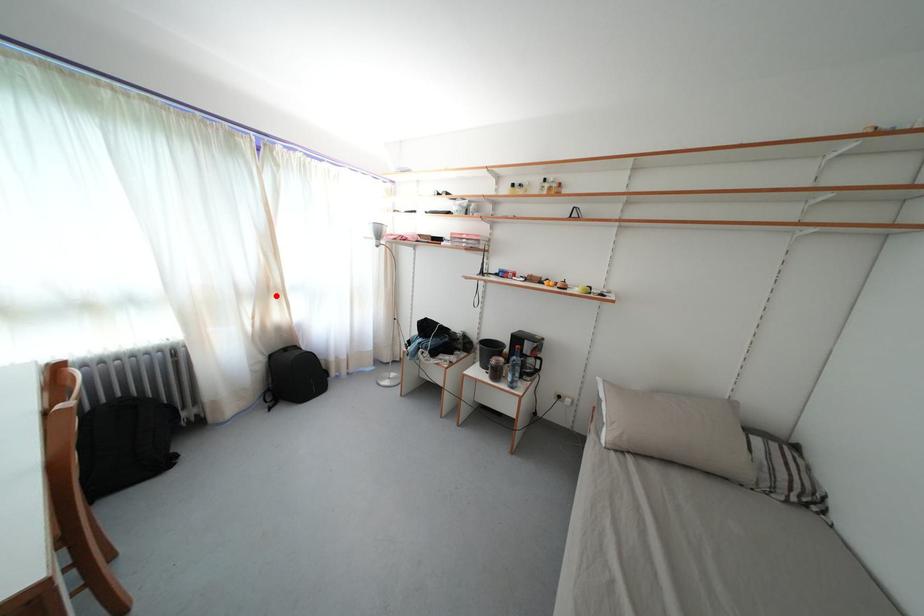
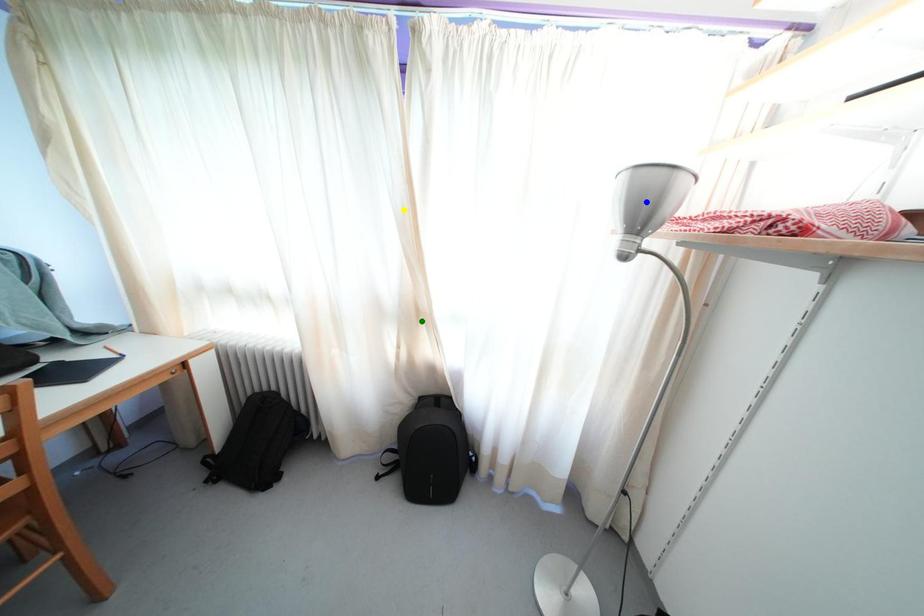
Question: I am providing you with two images of the same scene from different viewpoints. A red point is marked on the first image. You are given multiple points on the second image. In image 2, which mark is for the same physical point as the one in image 1?

Choices:
 (A) yellow point
 (B) green point
 (C) blue point

Answer: (B)